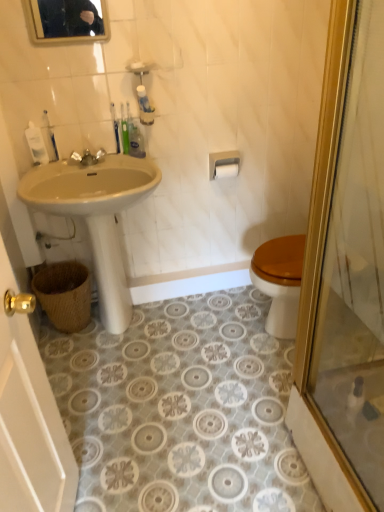
Question: Is the position of white matte toilet paper at upper center more distant than that of green matte tube at upper center, the 3th toiletry from the left?

Choices:
 (A) yes
 (B) no

Answer: (A)

Question: Does white matte toilet paper at upper center have a larger size compared to green matte tube at upper center, the 3th toiletry from the left?

Choices:
 (A) no
 (B) yes

Answer: (A)

Question: From the image's perspective, is white matte toilet paper at upper center over green matte tube at upper center, the first toiletry when ordered from right to left?

Choices:
 (A) yes
 (B) no

Answer: (B)

Question: Is white matte toilet paper at upper center located outside green matte tube at upper center, the first toiletry when ordered from right to left?

Choices:
 (A) no
 (B) yes

Answer: (B)

Question: Could green matte tube at upper center, the first toiletry when ordered from right to left, be considered to be inside white matte toilet paper at upper center?

Choices:
 (A) yes
 (B) no

Answer: (B)

Question: Considering the positions of gold-framed mirror at upper center and beige ceramic sink at left in the image, is gold-framed mirror at upper center wider or thinner than beige ceramic sink at left?

Choices:
 (A) wide
 (B) thin

Answer: (B)

Question: From a real-world perspective, is gold-framed mirror at upper center physically located above or below beige ceramic sink at left?

Choices:
 (A) above
 (B) below

Answer: (A)

Question: Considering the relative positions of gold-framed mirror at upper center and beige ceramic sink at left in the image provided, is gold-framed mirror at upper center to the left or to the right of beige ceramic sink at left?

Choices:
 (A) right
 (B) left

Answer: (B)

Question: Is point tap(77, 19) positioned closer to the camera than point tap(99, 225)?

Choices:
 (A) farther
 (B) closer

Answer: (B)

Question: Considering the positions of point (21, 183) and point (57, 482), is point (21, 183) closer or farther from the camera than point (57, 482)?

Choices:
 (A) closer
 (B) farther

Answer: (B)

Question: Looking at their shapes, would you say beige ceramic sink at left is wider or thinner than matte white sink at left?

Choices:
 (A) thin
 (B) wide

Answer: (B)

Question: From a real-world perspective, is beige ceramic sink at left above or below matte white sink at left?

Choices:
 (A) above
 (B) below

Answer: (B)

Question: Would you say beige ceramic sink at left is to the left or to the right of matte white sink at left in the picture?

Choices:
 (A) left
 (B) right

Answer: (B)

Question: From their relative heights in the image, would you say white plastic bottle at upper left, acting as the 1th toiletry starting from the left, is taller or shorter than woven brown basket at lower left?

Choices:
 (A) tall
 (B) short

Answer: (B)

Question: Is white plastic bottle at upper left, the third toiletry when ordered from right to left, bigger or smaller than woven brown basket at lower left?

Choices:
 (A) small
 (B) big

Answer: (A)